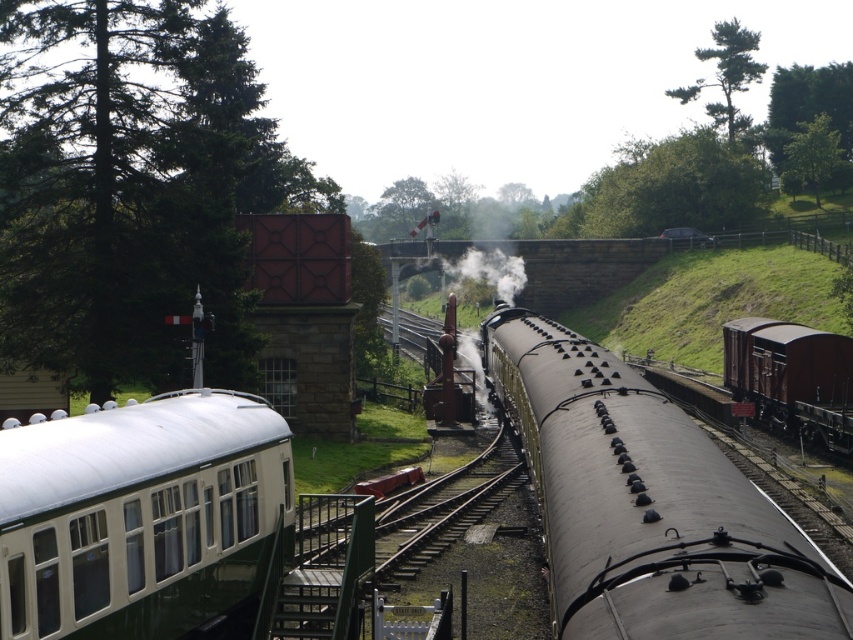
Question: Where is green leafy tree at upper center located in relation to green leafy tree at upper right in the image?

Choices:
 (A) above
 (B) below

Answer: (A)

Question: Is green leafy tree at upper left to the left of green leafy tree at upper right from the viewer's perspective?

Choices:
 (A) no
 (B) yes

Answer: (B)

Question: Estimate the real-world distances between objects in this image. Which object is farther from the green leafy tree at upper right?

Choices:
 (A) green leafy tree at upper center
 (B) green textured tree at upper right
 (C) green leafy tree at upper left
 (D) white glossy passenger train at lower left

Answer: (D)

Question: Which of the following is the closest to the observer?

Choices:
 (A) (117, 128)
 (B) (146, 428)
 (C) (831, 141)

Answer: (B)

Question: Is white glossy passenger train at lower left bigger than green leafy tree at upper center?

Choices:
 (A) no
 (B) yes

Answer: (A)

Question: Among these objects, which one is nearest to the camera?

Choices:
 (A) green leafy tree at upper left
 (B) brown matte freight car at right
 (C) white glossy passenger train at lower left
 (D) polished brass steam engine at center

Answer: (C)